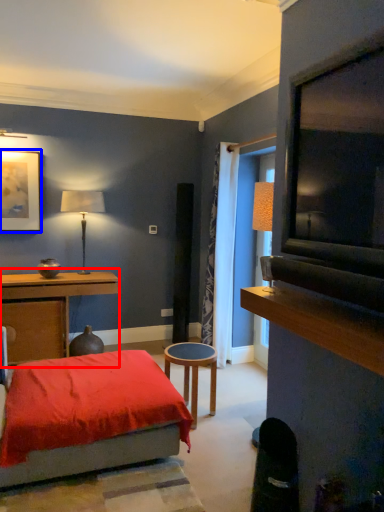
Question: Which object is further to the camera taking this photo, table (highlighted by a red box) or picture frame (highlighted by a blue box)?

Choices:
 (A) table
 (B) picture frame

Answer: (B)